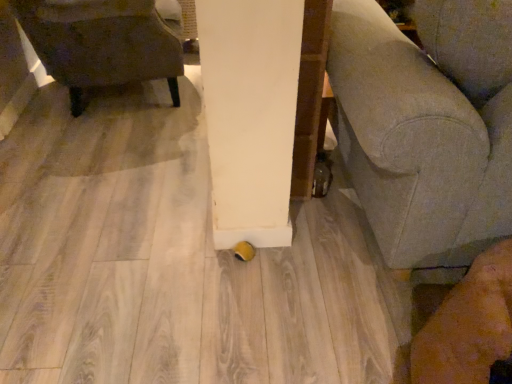
Question: In terms of width, does dark brown leather chair at left look wider or thinner when compared to gray fabric couch at lower right?

Choices:
 (A) wide
 (B) thin

Answer: (B)

Question: Is point click(82, 29) positioned closer to the camera than point click(415, 127)?

Choices:
 (A) closer
 (B) farther

Answer: (B)

Question: In terms of height, does dark brown leather chair at left look taller or shorter compared to gray fabric couch at lower right?

Choices:
 (A) tall
 (B) short

Answer: (B)

Question: Considering their positions, is gray fabric couch at lower right located in front of or behind dark brown leather chair at left?

Choices:
 (A) behind
 (B) front

Answer: (B)

Question: Choose the correct answer: Is gray fabric couch at lower right inside dark brown leather chair at left or outside it?

Choices:
 (A) outside
 (B) inside

Answer: (A)

Question: Considering the relative positions of gray fabric couch at lower right and dark brown leather chair at left in the image provided, is gray fabric couch at lower right to the left or to the right of dark brown leather chair at left?

Choices:
 (A) left
 (B) right

Answer: (B)

Question: Is point (408, 77) closer or farther from the camera than point (87, 1)?

Choices:
 (A) closer
 (B) farther

Answer: (A)